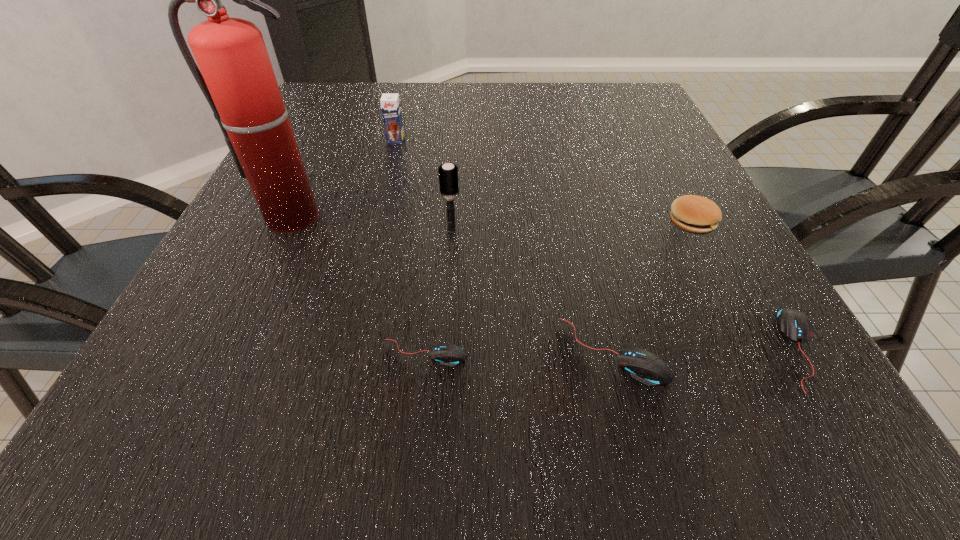
You are a GUI agent. You are given a task and a screenshot of the screen. Output one action in this format:
    pyautogui.click(x=<x>, y=<y>)
    Task: Click on the shortest object
    The image size is (960, 540).
    Given the screenshot: What is the action you would take?
    pyautogui.click(x=448, y=354)

At what (x,y) coordinates should I click in order to perform the action: click on the leftmost mouse. Please return your answer as a coordinate pair (x, y). Looking at the image, I should click on (448, 354).

Image resolution: width=960 pixels, height=540 pixels. In order to click on the second mouse from right to left in this screenshot , I will do coord(645,367).

Find the location of `the rightmost mouse`. the rightmost mouse is located at coordinates (794, 325).

Find the location of a particular element. The image size is (960, 540). the second tallest mouse is located at coordinates (794, 325).

Image resolution: width=960 pixels, height=540 pixels. I want to click on the farthest object, so click(x=390, y=104).

You are a GUI agent. You are given a task and a screenshot of the screen. Output one action in this format:
    pyautogui.click(x=<x>, y=<y>)
    Task: Click on the sixth object from right to left
    
    Given the screenshot: What is the action you would take?
    pyautogui.click(x=390, y=104)

Image resolution: width=960 pixels, height=540 pixels. I want to click on the leftmost object, so click(x=237, y=78).

Find the location of `the tallest object`. the tallest object is located at coordinates (x=237, y=78).

You are a GUI agent. You are given a task and a screenshot of the screen. Output one action in this format:
    pyautogui.click(x=<x>, y=<y>)
    Task: Click on the fourth tallest object
    
    Given the screenshot: What is the action you would take?
    pyautogui.click(x=694, y=214)